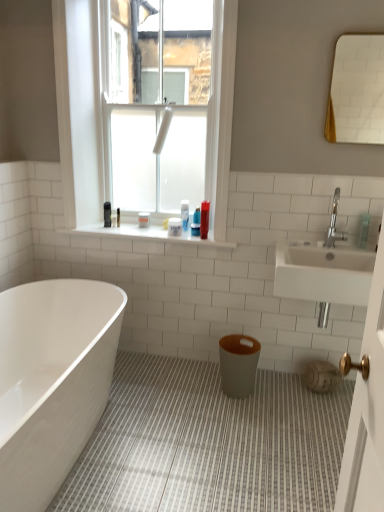
Locate an element on the screen. The image size is (384, 512). vacant region in front of white matte container at window, which appears as the first toiletry when viewed from the back is located at coordinates (147, 234).